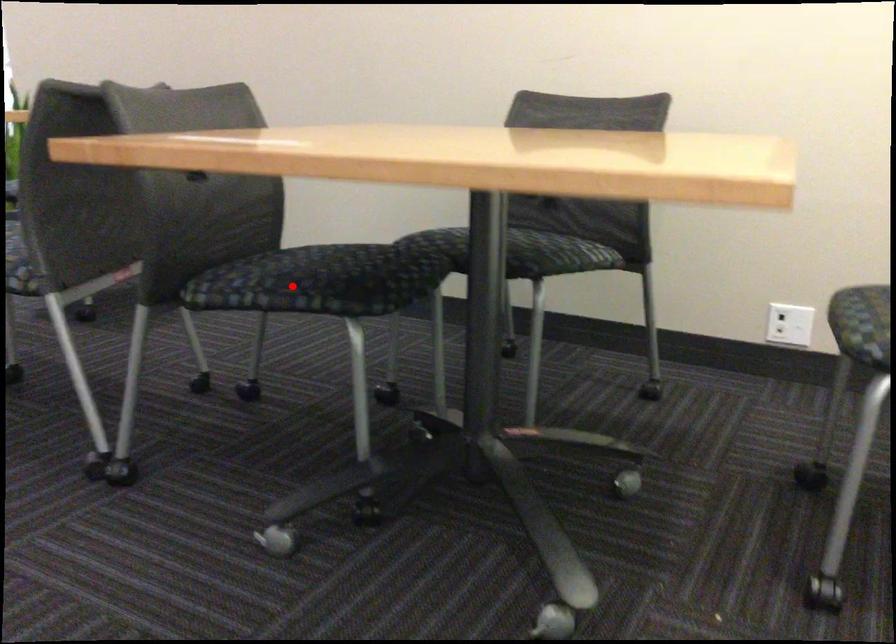
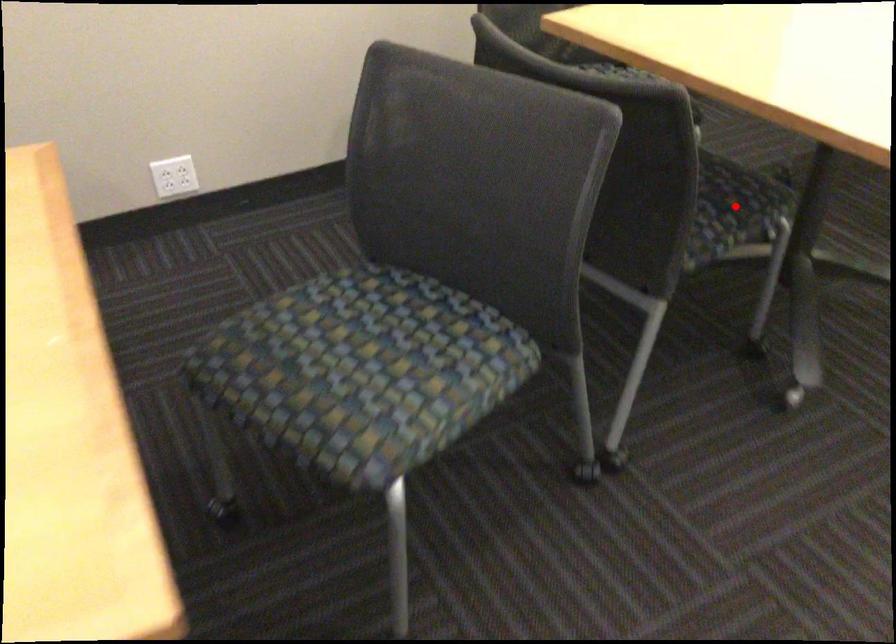
I am providing you with two images of the same scene from different viewpoints. A red point is marked on the first image and another point is marked on the second image. Does the point marked in image1 correspond to the same location as the one in image2?

Yes